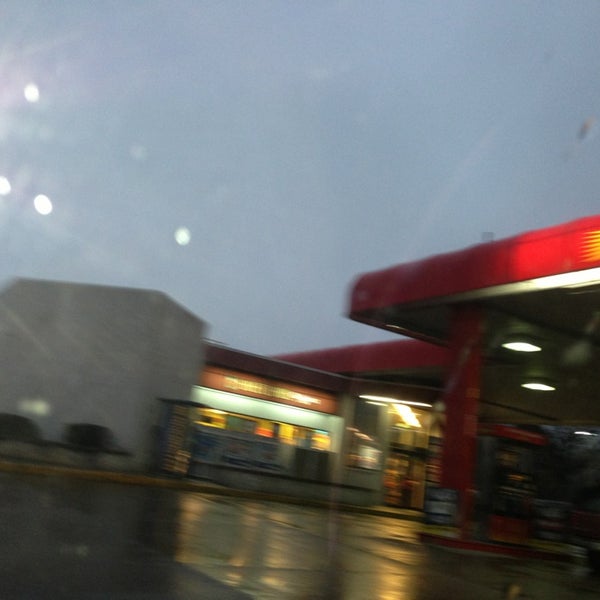
Identify the location of light. (517, 345).